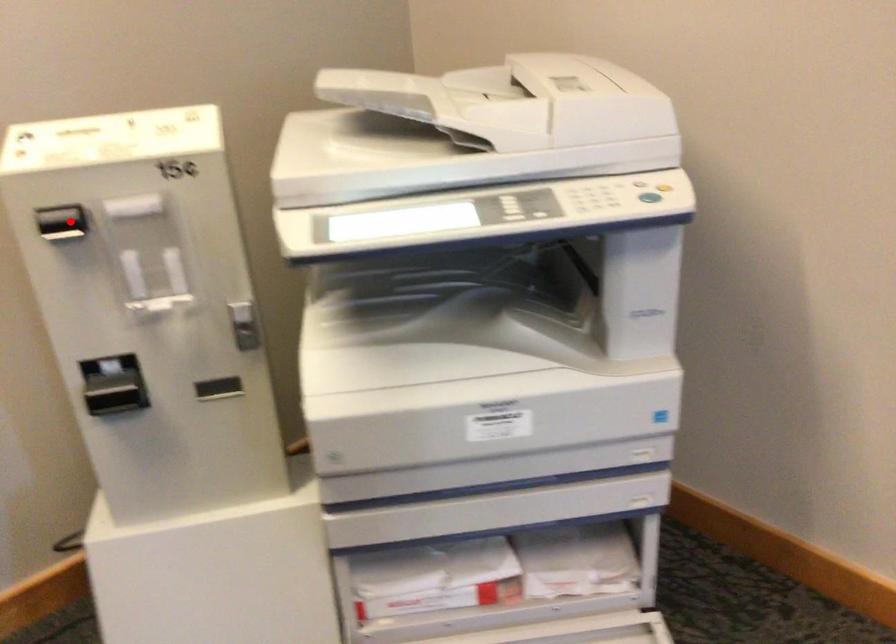
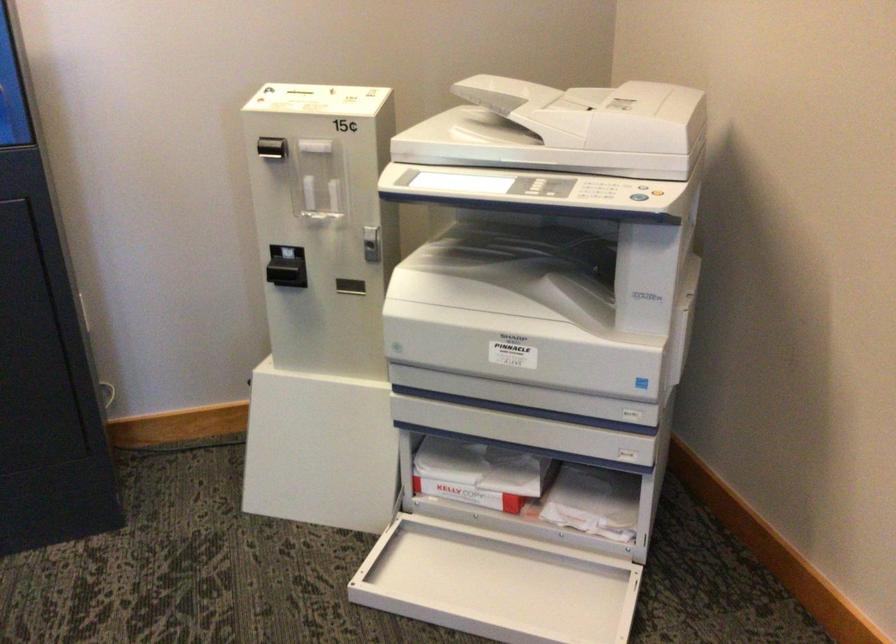
Question: I am providing you with two images of the same scene from different viewpoints. Given a red point in image1, look at the same physical point in image2. Is it:

Choices:
 (A) Closer to the viewpoint
 (B) Farther from the viewpoint

Answer: (B)